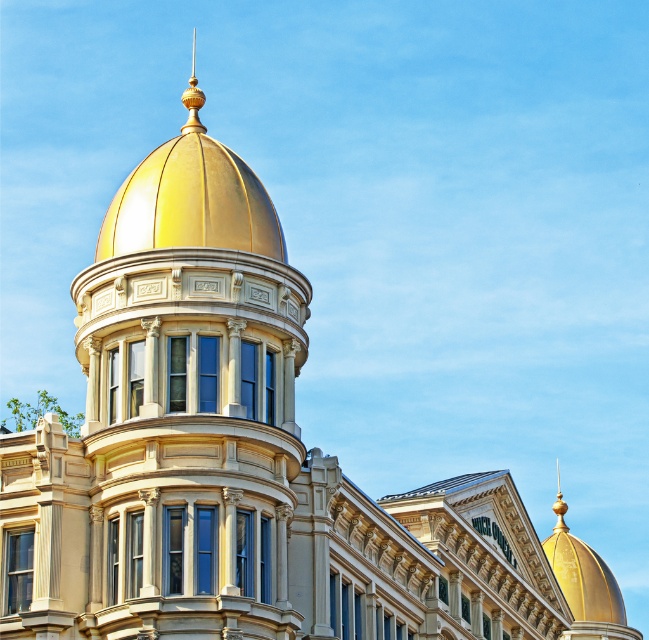
You are an architect reviewing the design of a building. You notice the gold polished dome at center and the gold polished spire at upper center. Which of these two elements is shorter in height?

The gold polished dome at center is shorter than the gold polished spire at upper center.

You are an architect reviewing the design of a building. You notice the gold polished dome at center and the gold polished spire at upper center. Which of these two elements takes up more visual space in the design?

The gold polished spire at upper center occupies more visual space than the gold polished dome at center, according to the description provided.

You are an architect examining the building facade. You notice the gold polished dome at center and the gold polished spire at upper center. Which of these two elements has a smaller width?

The gold polished dome at center has a lesser width compared to the gold polished spire at upper center.